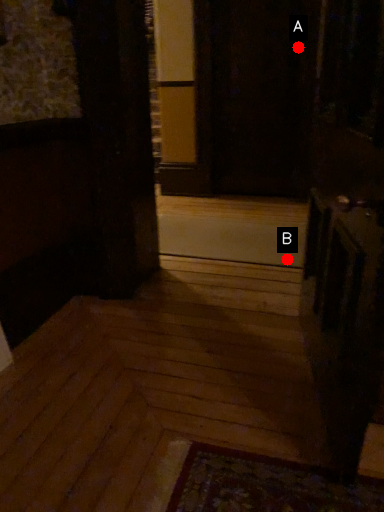
Question: Two points are circled on the image, labeled by A and B beside each circle. Which point is farther to the camera?

Choices:
 (A) A is further
 (B) B is further

Answer: (A)